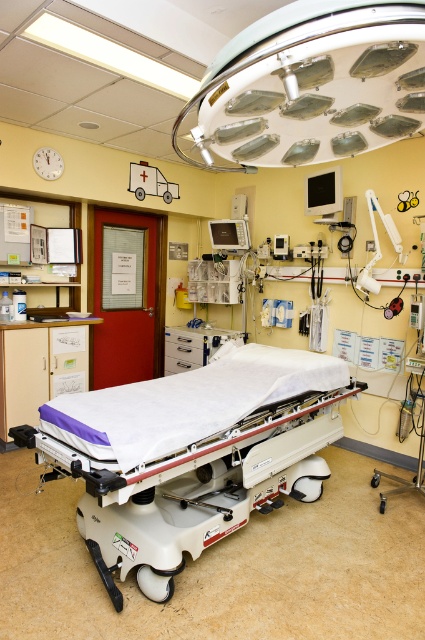
You are a nurse who needs to move a medical chart from the bulletin board to the white matte bed at center. Can you do this without needing to move any furniture?

Yes, because the distance between them is 6.21 feet, which is enough space to move the chart without moving any furniture.

You are standing in the medical examination room and want to take a photo of the point at coordinates point (368, 80). If your camera has a maximum focus range of 1.5 meters, will it be able to focus on the point?

The distance between point (368, 80) and the camera is 1.41 meters, which is within the camera maximum focus range of 1.5 meters. Therefore, the camera can focus on the point.

You are a patient in a hospital room and need to locate the ambulance illustration on the wall. Given that you can see both the white matte bed at center and the matte white ambulance at upper left, which object appears smaller in the image?

The matte white ambulance at upper left appears smaller because the white matte bed at center is larger in size than the matte white ambulance at upper left.